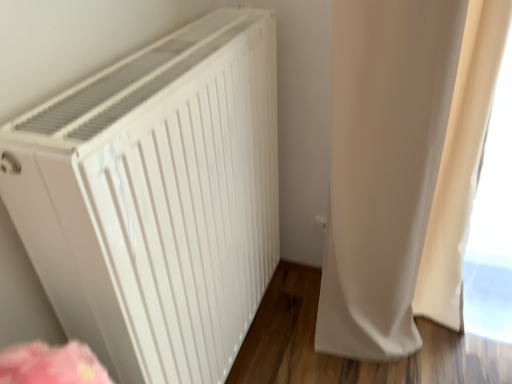
Question: Considering the relative sizes of white matte radiator at left and beige fabric curtain at right in the image provided, is white matte radiator at left smaller than beige fabric curtain at right?

Choices:
 (A) yes
 (B) no

Answer: (B)

Question: Is white matte radiator at left bigger than beige fabric curtain at right?

Choices:
 (A) yes
 (B) no

Answer: (A)

Question: Does white matte radiator at left appear on the left side of beige fabric curtain at right?

Choices:
 (A) no
 (B) yes

Answer: (B)

Question: From the image's perspective, would you say white matte radiator at left is shown under beige fabric curtain at right?

Choices:
 (A) yes
 (B) no

Answer: (A)

Question: Does white matte radiator at left appear on the right side of beige fabric curtain at right?

Choices:
 (A) no
 (B) yes

Answer: (A)

Question: Is white matte radiator at left further to the viewer compared to beige fabric curtain at right?

Choices:
 (A) no
 (B) yes

Answer: (A)

Question: Would you consider beige fabric curtain at right to be distant from white matte radiator at left?

Choices:
 (A) no
 (B) yes

Answer: (A)

Question: Is beige fabric curtain at right aimed at white matte radiator at left?

Choices:
 (A) no
 (B) yes

Answer: (A)

Question: Does beige fabric curtain at right have a lesser height compared to white matte radiator at left?

Choices:
 (A) yes
 (B) no

Answer: (B)

Question: Does beige fabric curtain at right have a smaller size compared to white matte radiator at left?

Choices:
 (A) no
 (B) yes

Answer: (B)

Question: From the image's perspective, would you say beige fabric curtain at right is shown under white matte radiator at left?

Choices:
 (A) yes
 (B) no

Answer: (B)

Question: Is beige fabric curtain at right positioned with its back to white matte radiator at left?

Choices:
 (A) no
 (B) yes

Answer: (A)

Question: In terms of height, does white matte radiator at left look taller or shorter compared to beige fabric curtain at right?

Choices:
 (A) short
 (B) tall

Answer: (A)